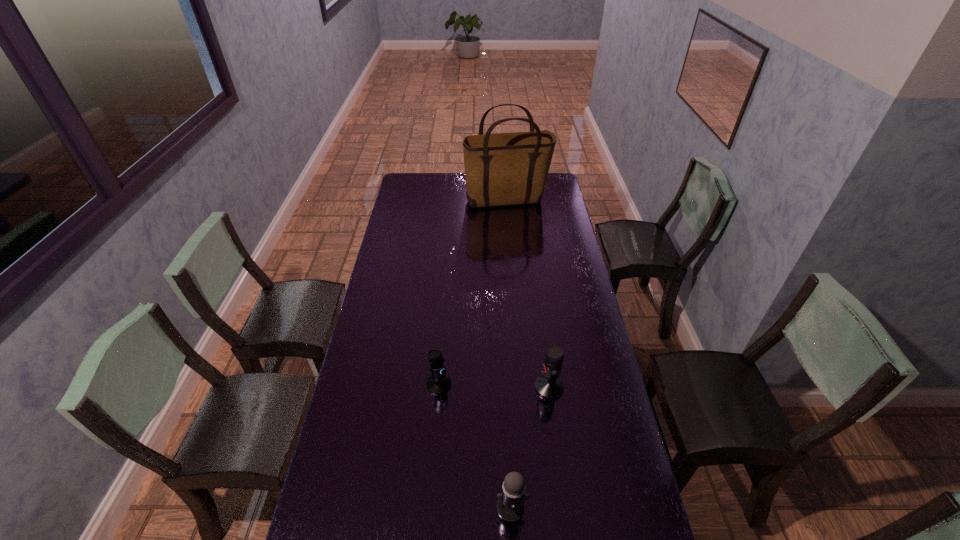
Find the location of a particular element. Image resolution: width=960 pixels, height=540 pixels. object that is the second nearest to the nearest object is located at coordinates (439, 382).

This screenshot has width=960, height=540. Identify the location of microphone object that ranks as the closest to the leftmost object. (549, 385).

You are a GUI agent. You are given a task and a screenshot of the screen. Output one action in this format:
    pyautogui.click(x=<x>, y=<y>)
    Task: Click on the microphone that is the closest to the second microphone from left to right
    Image resolution: width=960 pixels, height=540 pixels.
    Given the screenshot: What is the action you would take?
    pyautogui.click(x=549, y=385)

In order to click on free region that satisfies the following two spatial constraints: 1. on the side of the rightmost microphone with the red ring; 2. on the front side of the nearest object in this screenshot , I will do `click(565, 507)`.

You are a GUI agent. You are given a task and a screenshot of the screen. Output one action in this format:
    pyautogui.click(x=<x>, y=<y>)
    Task: Click on the free space that satisfies the following two spatial constraints: 1. on the side of the rightmost microphone with the red ring; 2. on the front side of the second microphone from right to left
    The height and width of the screenshot is (540, 960).
    Given the screenshot: What is the action you would take?
    pyautogui.click(x=565, y=507)

Identify the location of vacant space that satisfies the following two spatial constraints: 1. on the side of the rightmost microphone with the red ring; 2. on the front side of the second microphone from left to right. coord(565,507).